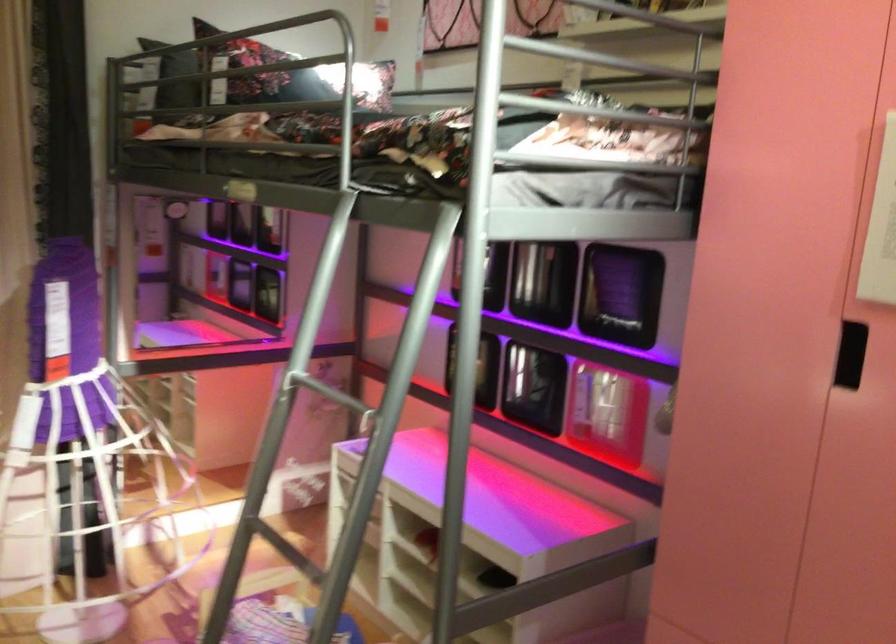
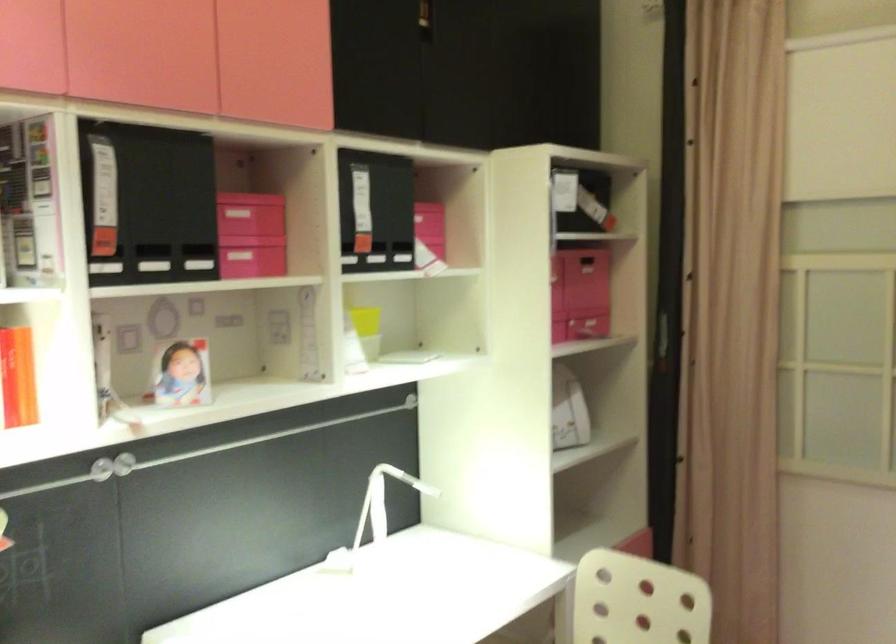
Question: The camera is either moving clockwise (left) or counter-clockwise (right) around the object. The first image is from the beginning of the video and the second image is from the end. Is the camera moving left or right when shooting the video?

Choices:
 (A) Left
 (B) Right

Answer: (B)